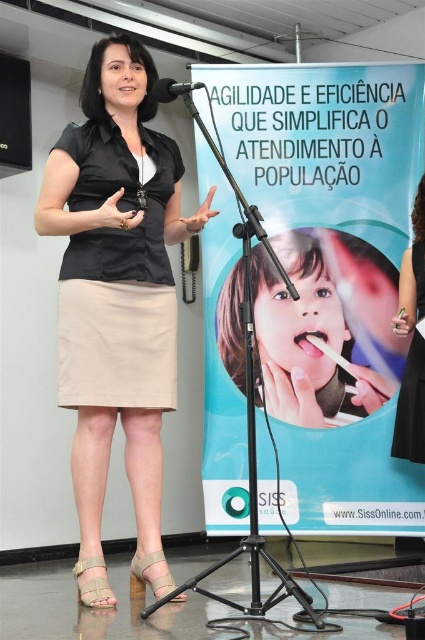
You are a photographer adjusting your camera settings to capture the scene. You notice two points in the image at coordinates point (138, 125) and point (2, 131). Which point should you focus on to ensure the subject in the foreground is sharp?

Point (138, 125) is closer to the camera than point (2, 131), so focusing on point (138, 125) will ensure the foreground subject is sharp.

You are a photographer adjusting your camera settings to focus on two points in the scene. The first point is at coordinate point (289, 339) and the second is at point (167, 80). Which point should you focus on first if you want to ensure both are in focus, considering their depth?

Point (289, 339) is further to the camera than point (167, 80), so you should focus on point (289, 339) first to ensure both are in focus since it is closer to the camera.